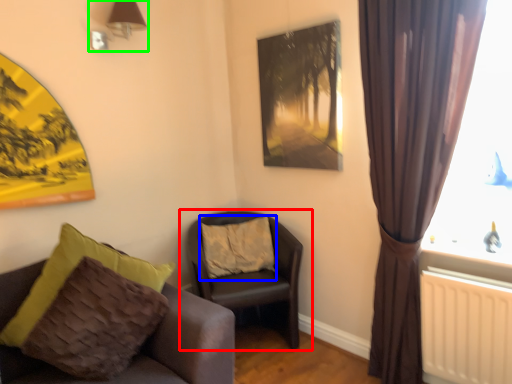
Question: Which object is positioned farthest from chair (highlighted by a red box)? Select from pillow (highlighted by a blue box) and lamp (highlighted by a green box).

Choices:
 (A) pillow
 (B) lamp

Answer: (B)